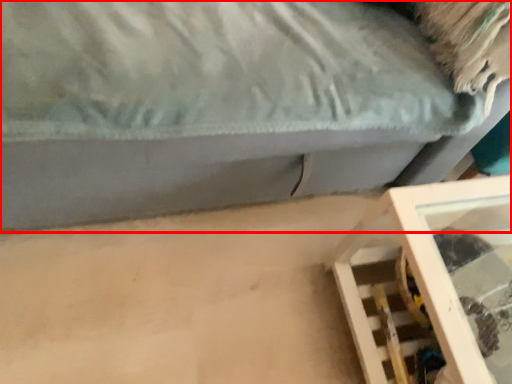
Question: In this image, where is furniture (annotated by the red box) located relative to furniture?

Choices:
 (A) right
 (B) left

Answer: (B)